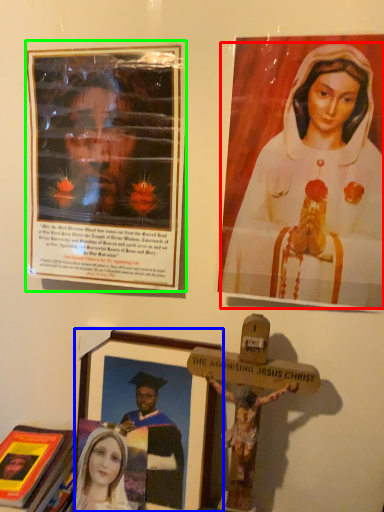
Question: Which object is the closest to the woman (highlighted by a red box)? Choose among these: picture frame (highlighted by a blue box) or picture frame (highlighted by a green box).

Choices:
 (A) picture frame
 (B) picture frame

Answer: (B)